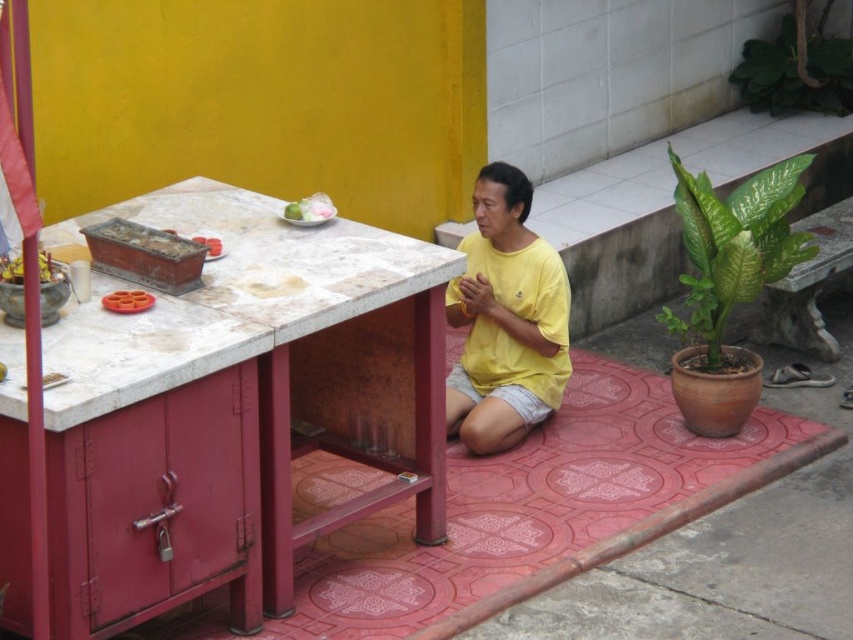
You are standing in front of the red cabinet with a white countertop and see two points marked on the counter. Which point is closer to you, point (805, 157) or point (297, 205)?

Point (297, 205) is closer to you because it is less far from the camera than point (805, 157).

You are a photographer standing 3 feet away from the scene. You want to capture a closeup shot of the green matte fruit at upper center without the white glossy plate at center appearing in the frame. Is it possible to do so given their distance?

The white glossy plate at center is 21.05 inches away from the green matte fruit at upper center. Since the photographer is standing 3 feet away, which is approximately 36 inches, the distance between the two objects is less than the photographer distance. Therefore, adjusting the camera angle slightly could allow capturing the green matte fruit at upper center without the white glossy plate at center in the frame.

You are a photographer taking a picture of the scene. You want to ensure both the yellow matte shirt at center and the green leafy plant at upper right are clearly visible. Which object should you focus on first to ensure depth of field captures both?

Result: You should focus on the yellow matte shirt at center first because it is closer to the camera than the green leafy plant at upper right, ensuring both are in focus with proper depth of field.